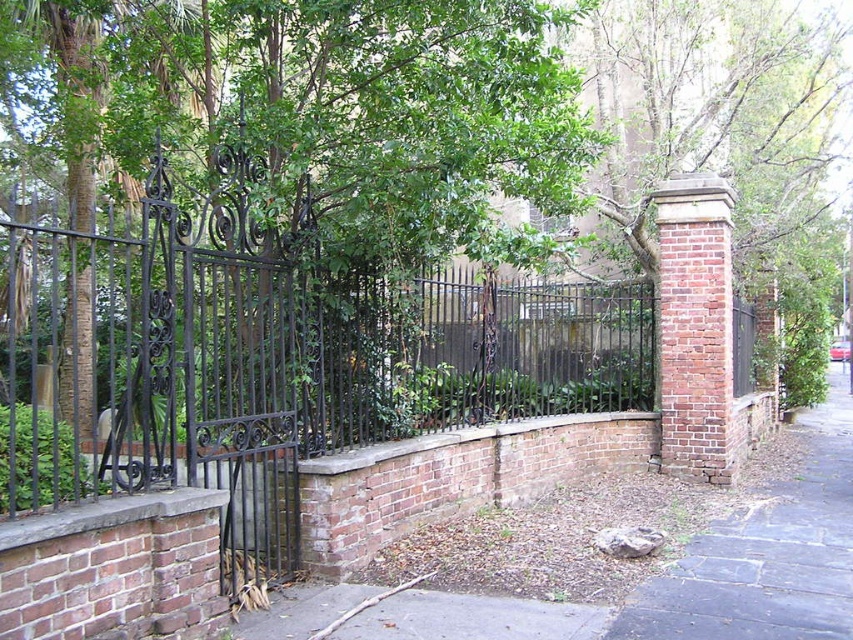
Question: Does black wrought iron fence at center have a smaller size compared to brown stone pavement at lower right?

Choices:
 (A) yes
 (B) no

Answer: (B)

Question: Where is black wrought iron fence at center located in relation to brown stone pavement at lower right in the image?

Choices:
 (A) right
 (B) left

Answer: (B)

Question: Among these objects, which one is nearest to the camera?

Choices:
 (A) black wrought iron fence at center
 (B) brown stone pavement at lower right

Answer: (A)

Question: Is black wrought iron fence at center above brown stone pavement at lower right?

Choices:
 (A) no
 (B) yes

Answer: (B)